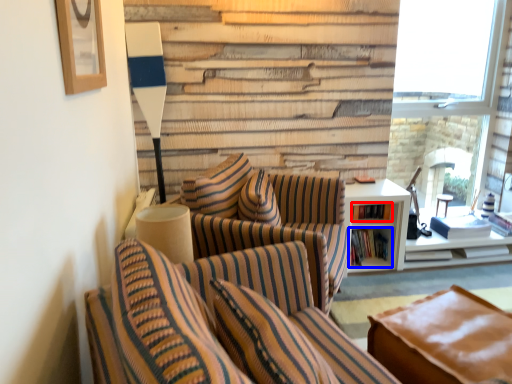
Question: Which object appears closest to the camera in this image, book (highlighted by a red box) or book (highlighted by a blue box)?

Choices:
 (A) book
 (B) book

Answer: (B)